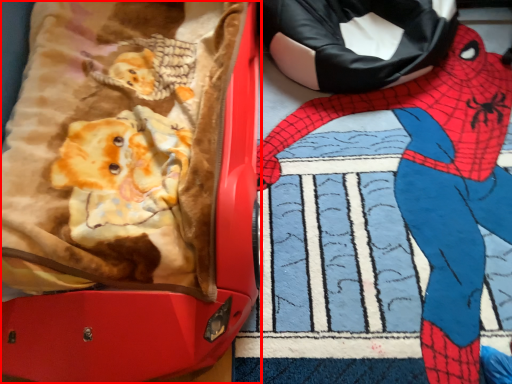
Question: Considering the relative positions of suitcase (annotated by the red box) and person in the image provided, where is suitcase (annotated by the red box) located with respect to the staircase?

Choices:
 (A) left
 (B) right

Answer: (A)